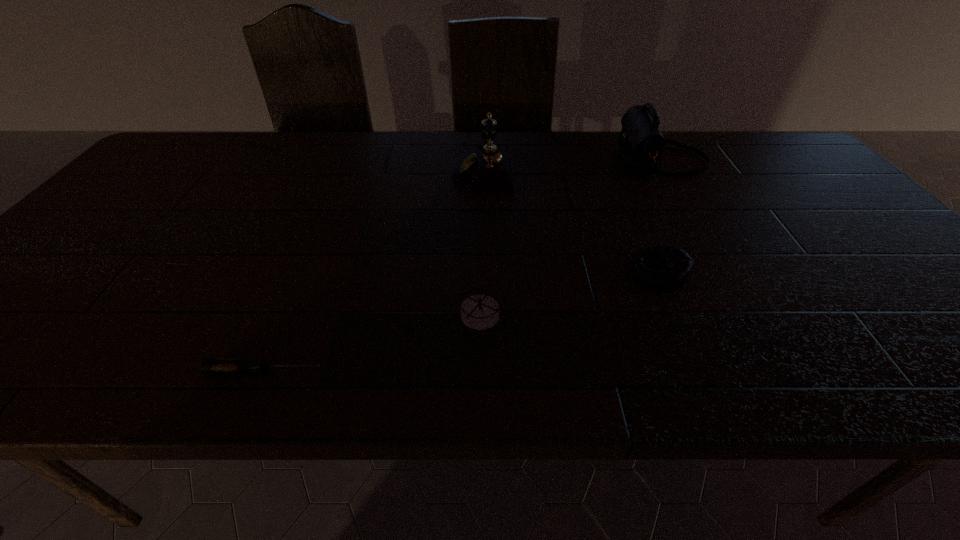
Locate an element on the screen. This screenshot has width=960, height=540. free area in between the leftmost object and the compass is located at coordinates (372, 342).

What are the coordinates of `blank region between the shoulder bag and the telephone` in the screenshot? It's located at (572, 165).

Select which object is the closest to the nearest object. Please provide its 2D coordinates. Your answer should be formatted as a tuple, i.e. [(x, y)], where the tuple contains the x and y coordinates of a point satisfying the conditions above.

[(479, 312)]

Point out which object is positioned as the third nearest to the beanbag. Please provide its 2D coordinates. Your answer should be formatted as a tuple, i.e. [(x, y)], where the tuple contains the x and y coordinates of a point satisfying the conditions above.

[(488, 170)]

Where is `vacant space that satisfies the following two spatial constraints: 1. on the front side of the third farthest object; 2. insert the nearest object into a screw head`? The height and width of the screenshot is (540, 960). vacant space that satisfies the following two spatial constraints: 1. on the front side of the third farthest object; 2. insert the nearest object into a screw head is located at coordinates (698, 370).